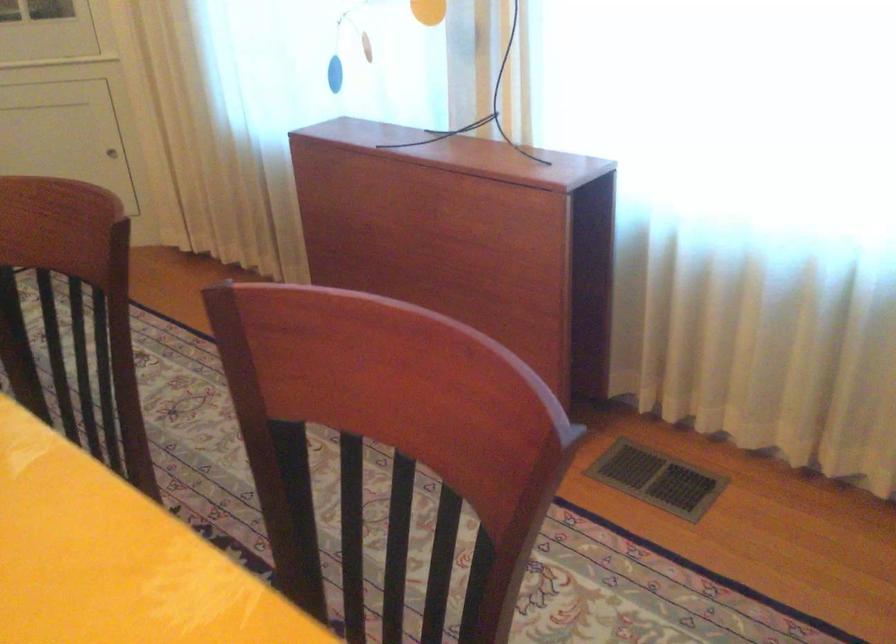
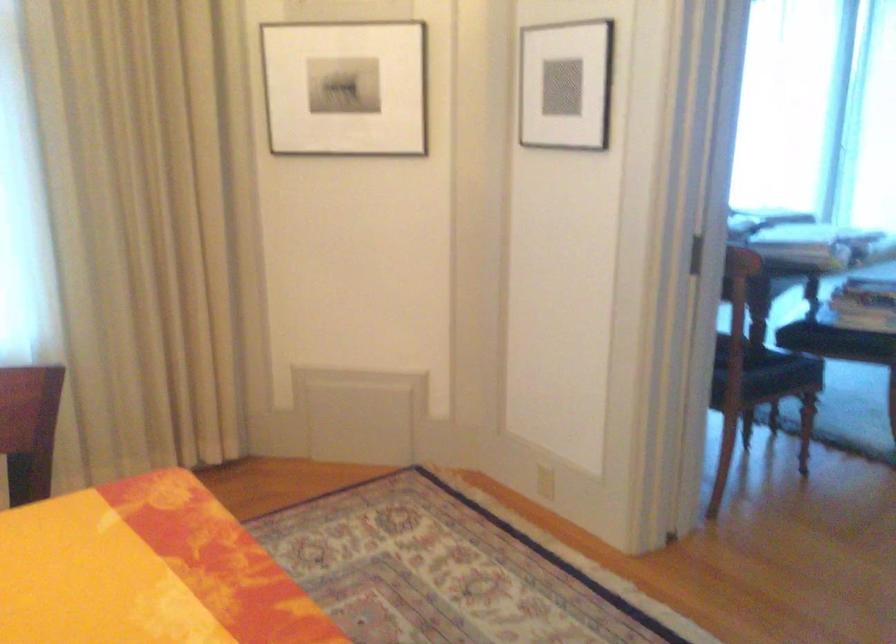
Question: The camera is either moving clockwise (left) or counter-clockwise (right) around the object. The first image is from the beginning of the video and the second image is from the end. Is the camera moving left or right when shooting the video?

Choices:
 (A) Left
 (B) Right

Answer: (A)